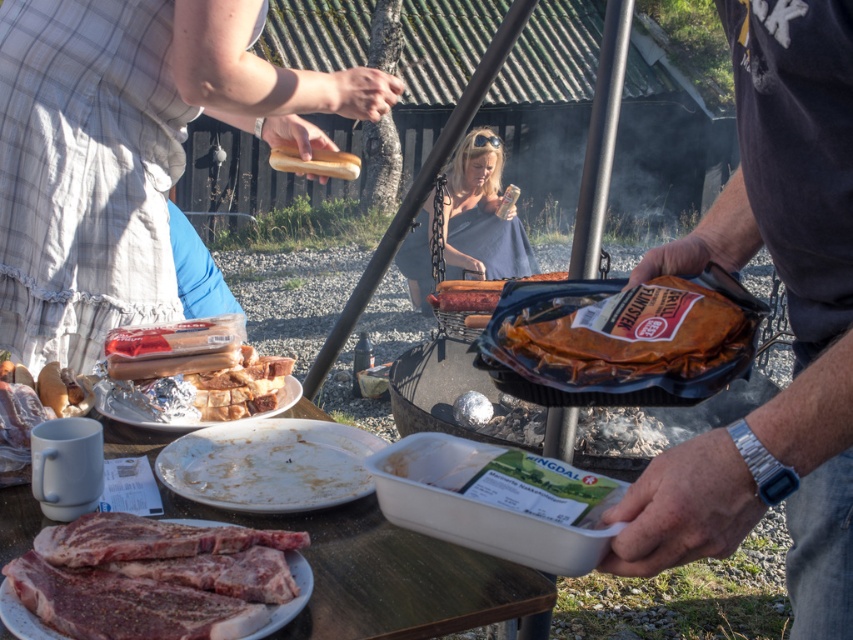
Question: Is brown paper wrapped meat at center closer to camera compared to silver foil plate at center?

Choices:
 (A) no
 (B) yes

Answer: (A)

Question: Which of these objects is positioned closest to the dark gray fabric shirt at center?

Choices:
 (A) silver foil plate at center
 (B) translucent plastic hot dogs at lower left
 (C) white matte plate at center
 (D) gray matte dress at center

Answer: (C)

Question: Is shiny brown meat at center wider than translucent plastic hot dogs at lower left?

Choices:
 (A) yes
 (B) no

Answer: (A)

Question: Does shiny brown meat at center have a greater width compared to gray matte dress at center?

Choices:
 (A) no
 (B) yes

Answer: (A)

Question: Which of the following is the farthest from the observer?

Choices:
 (A) [103, 209]
 (B) [734, 461]

Answer: (A)

Question: Which point is closer to the camera?

Choices:
 (A) (198, 61)
 (B) (444, 289)

Answer: (A)